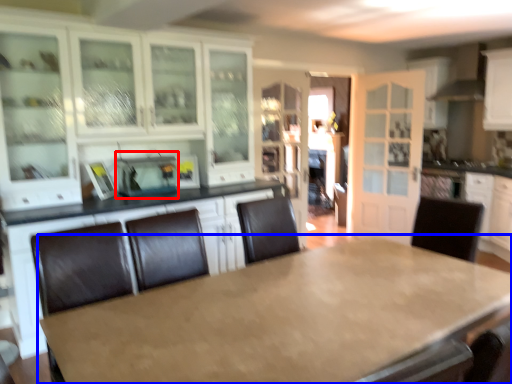
Question: Which of the following is the closest to the observer, appliance (highlighted by a red box) or table (highlighted by a blue box)?

Choices:
 (A) appliance
 (B) table

Answer: (B)